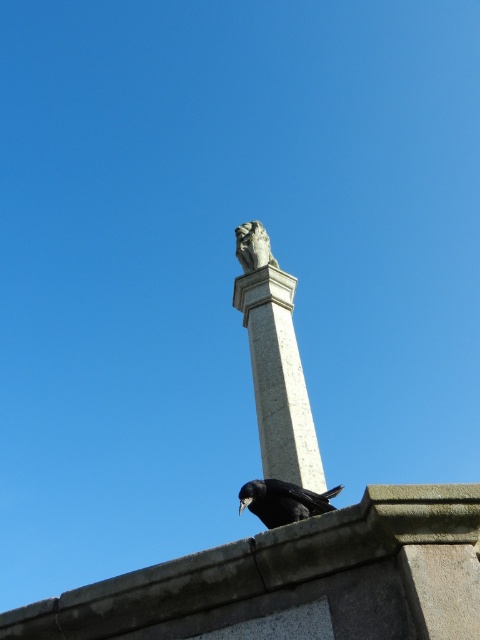
Can you confirm if white stone column at upper center is positioned above shiny black bird at center?

Yes.

Is white stone column at upper center further to the viewer compared to shiny black bird at center?

Yes, white stone column at upper center is behind shiny black bird at center.

Where is `white stone column at upper center`? The image size is (480, 640). white stone column at upper center is located at coordinates (276, 388).

Locate an element on the screen. white stone column at upper center is located at coordinates (276, 388).